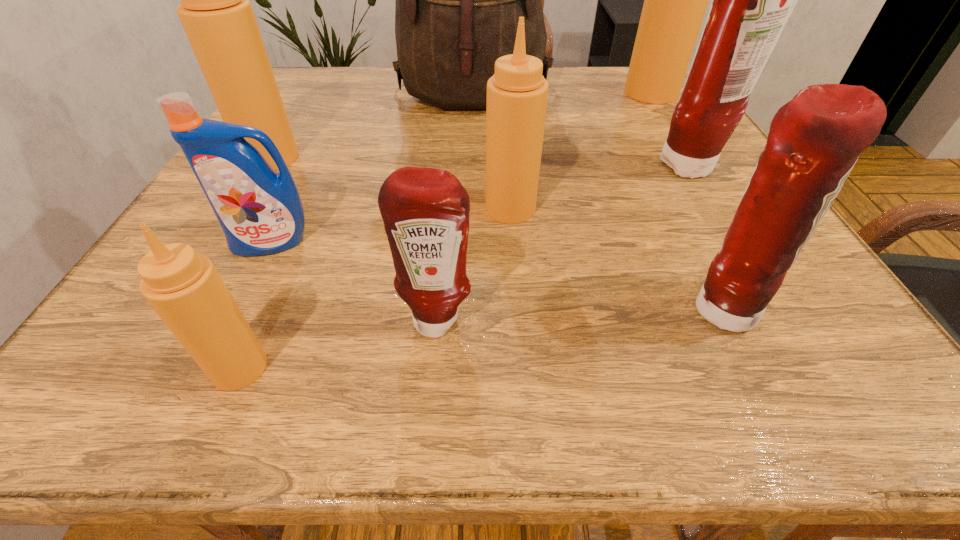
You are a GUI agent. You are given a task and a screenshot of the screen. Output one action in this format:
    pyautogui.click(x=<x>, y=<y>)
    Task: Click on the third condiment from left to right
    
    Given the screenshot: What is the action you would take?
    pyautogui.click(x=425, y=211)

Find the location of a particular element. The image size is (960, 540). the smallest red condiment is located at coordinates (425, 211).

At what (x,y) coordinates should I click in order to perform the action: click on the nearest tan condiment. Please return your answer as a coordinate pair (x, y). The height and width of the screenshot is (540, 960). Looking at the image, I should click on (184, 288).

Identify the location of the nearest object. The width and height of the screenshot is (960, 540). (184, 288).

Where is `vacant space located on the open flap of the backpack`? vacant space located on the open flap of the backpack is located at coordinates (470, 203).

Find the location of a particular element. free space located 0.310m on the left of the rightmost tan condiment is located at coordinates (499, 93).

This screenshot has width=960, height=540. Find the location of `vacant space located 0.290m on the left of the farthest red condiment`. vacant space located 0.290m on the left of the farthest red condiment is located at coordinates (502, 167).

The width and height of the screenshot is (960, 540). What are the coordinates of `free spot located 0.170m on the front of the leftmost tan condiment` in the screenshot? It's located at (226, 230).

Find the location of a particular element. The height and width of the screenshot is (540, 960). free point located 0.370m on the left of the fifth farthest object is located at coordinates (272, 208).

Where is `free space located on the left of the second biggest red condiment`? This screenshot has width=960, height=540. free space located on the left of the second biggest red condiment is located at coordinates 394,309.